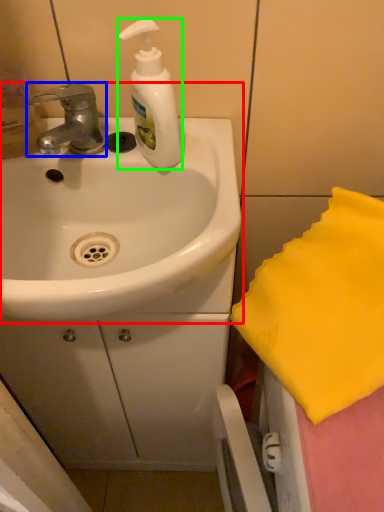
Question: Which object is positioned farthest from sink (highlighted by a red box)? Select from tap (highlighted by a blue box) and soap dispenser (highlighted by a green box).

Choices:
 (A) tap
 (B) soap dispenser

Answer: (A)